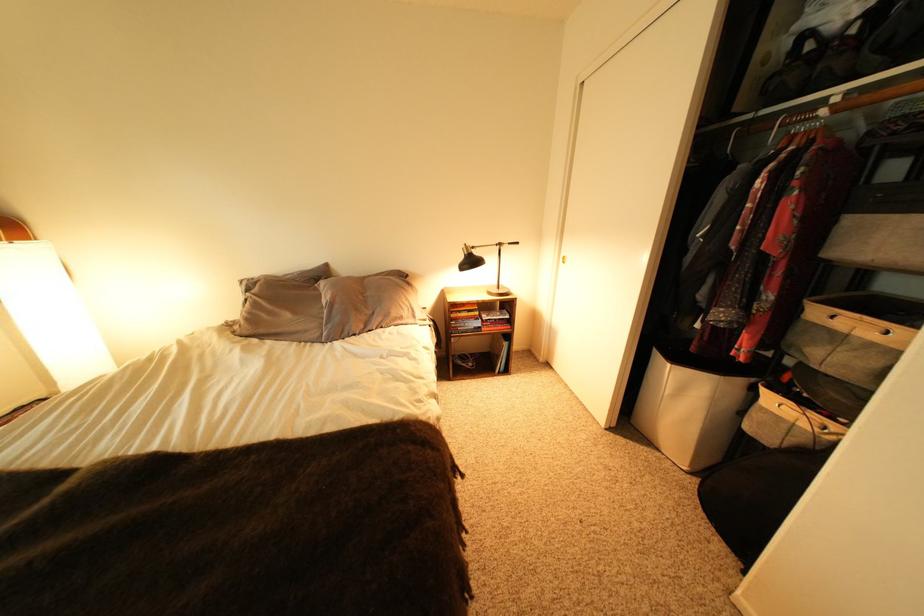
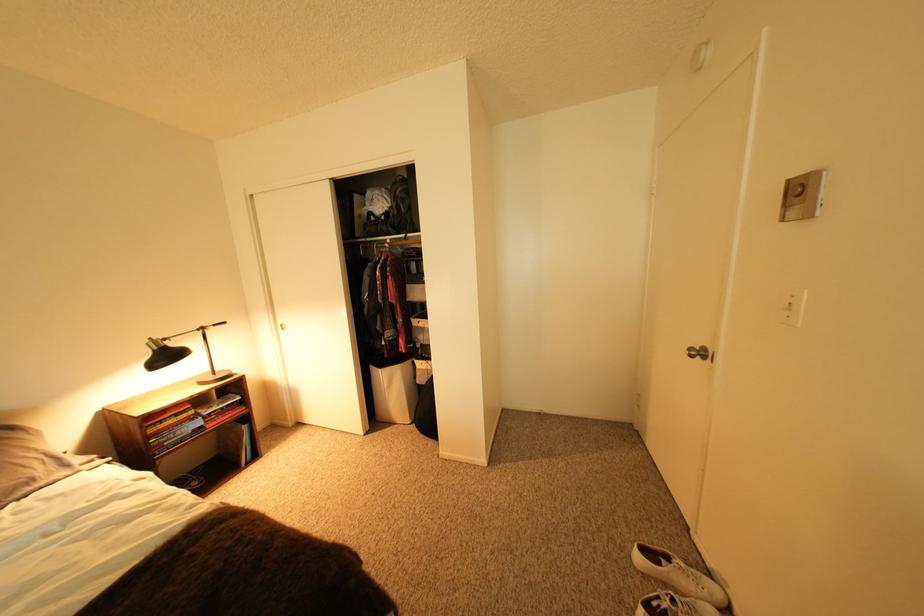
The point at (479, 254) is marked in the first image. Where is the corresponding point in the second image?

(168, 350)